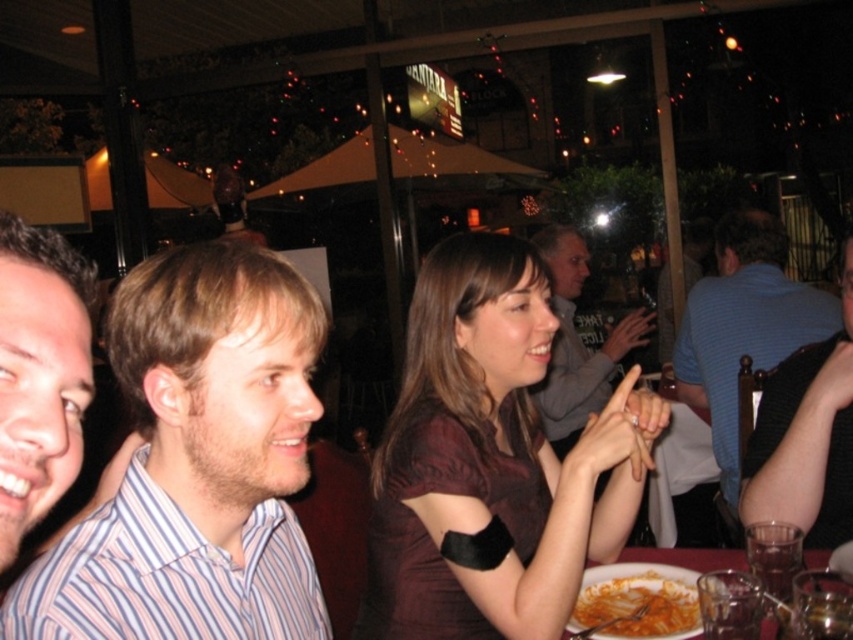
Is striped cotton shirt at left to the left of gray sweater at center from the viewer's perspective?

Correct, you'll find striped cotton shirt at left to the left of gray sweater at center.

Who is higher up, striped cotton shirt at left or gray sweater at center?

gray sweater at center is higher up.

This screenshot has height=640, width=853. Identify the location of striped cotton shirt at left. (196, 464).

Which of these two, matte brown dress at center or striped shirt at left, stands shorter?

striped shirt at left

Between matte brown dress at center and striped shirt at left, which one is positioned higher?

striped shirt at left is above.

Locate an element on the screen. matte brown dress at center is located at coordinates (491, 461).

Based on the photo, who is positioned more to the left, matte brown dress at center or blue striped shirt at right?

matte brown dress at center

Between point (585, 440) and point (758, 305), which one is positioned in front?

Positioned in front is point (585, 440).

Between point (508, 616) and point (730, 234), which one is positioned in front?

Positioned in front is point (508, 616).

Locate an element on the screen. Image resolution: width=853 pixels, height=640 pixels. matte brown dress at center is located at coordinates (491, 461).